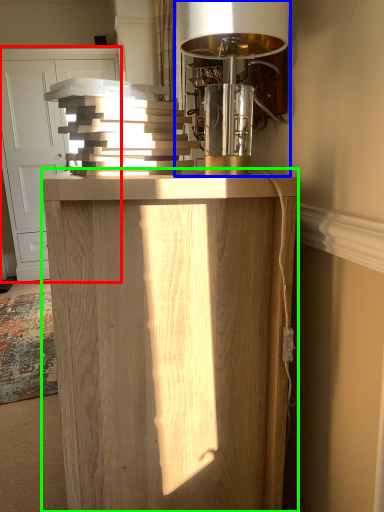
Question: Which is farther away from cabinetry (highlighted by a red box)? table lamp (highlighted by a blue box) or furniture (highlighted by a green box)?

Choices:
 (A) table lamp
 (B) furniture

Answer: (B)